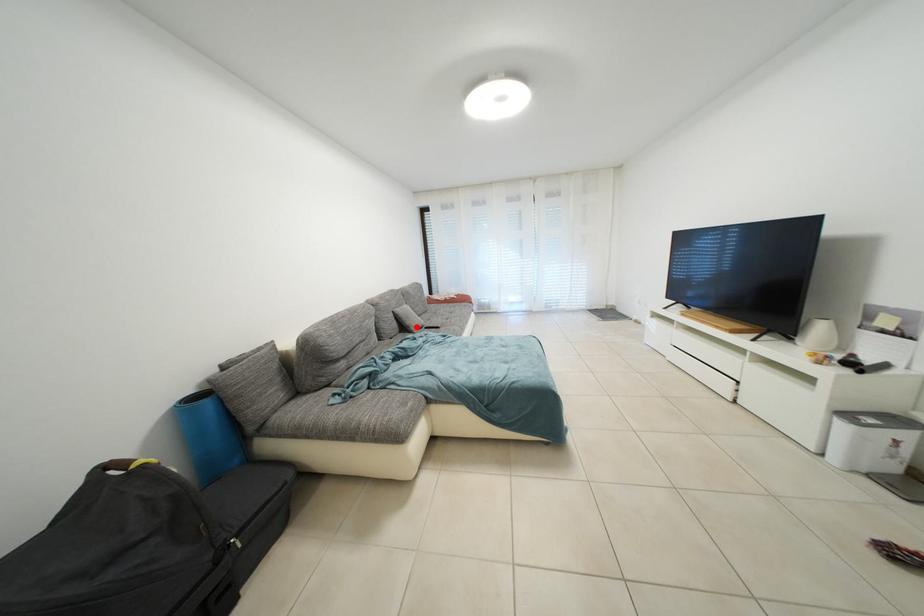
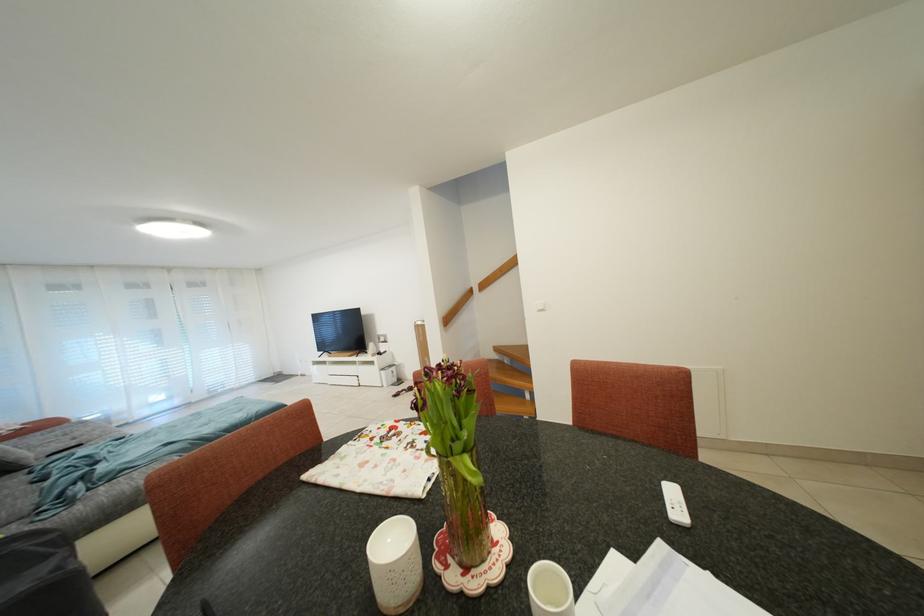
Where in the second image is the point corresponding to the highlighted location from the first image?

(19, 462)